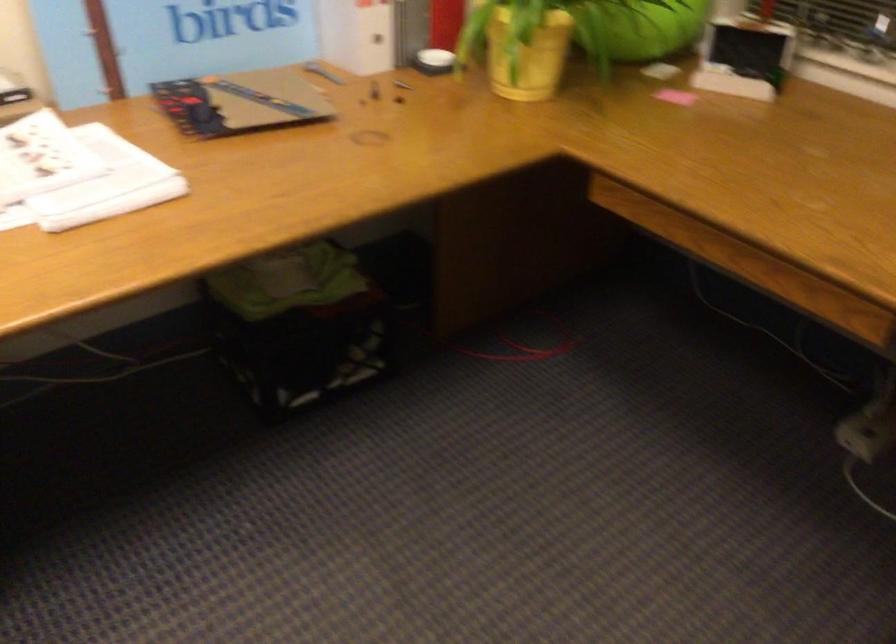
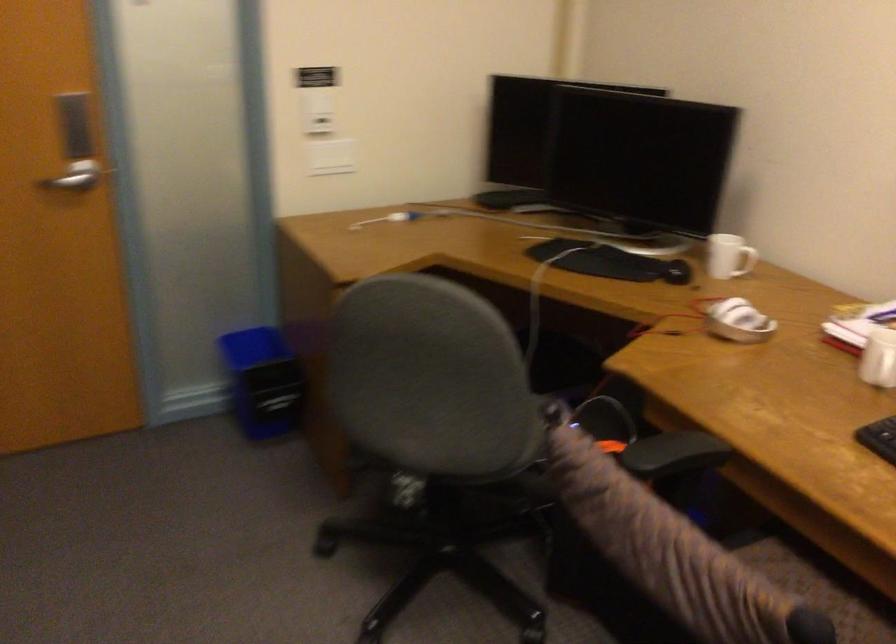
How did the camera likely rotate?

The rotation direction of the camera is left-down.